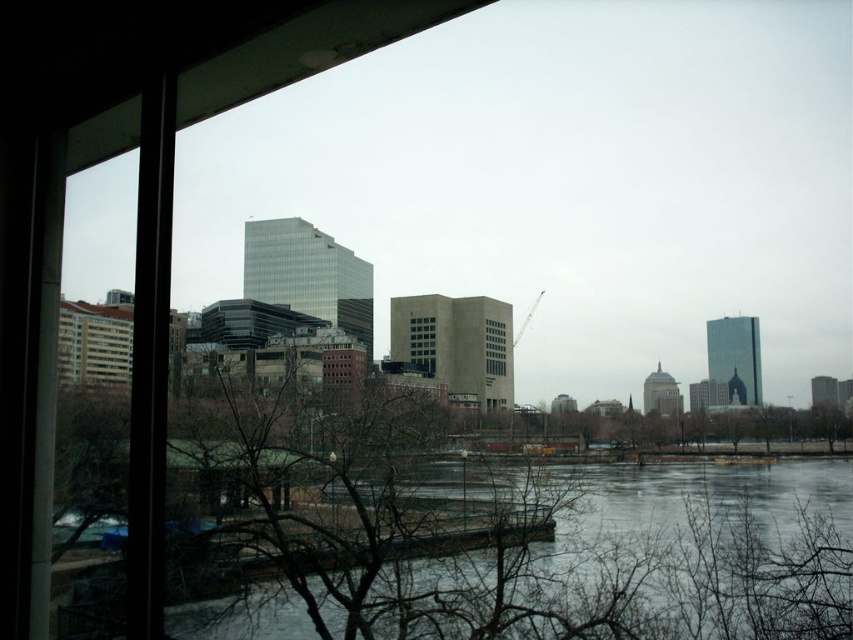
Question: Which point is closer to the camera taking this photo?

Choices:
 (A) (489, 321)
 (B) (416, 362)

Answer: (B)

Question: Is matte glass building at center positioned before clear glass building at center?

Choices:
 (A) yes
 (B) no

Answer: (A)

Question: Does matte glass building at center have a lesser width compared to clear glass building at center?

Choices:
 (A) yes
 (B) no

Answer: (B)

Question: Can you confirm if matte glass building at center is positioned to the right of clear glass building at center?

Choices:
 (A) yes
 (B) no

Answer: (B)